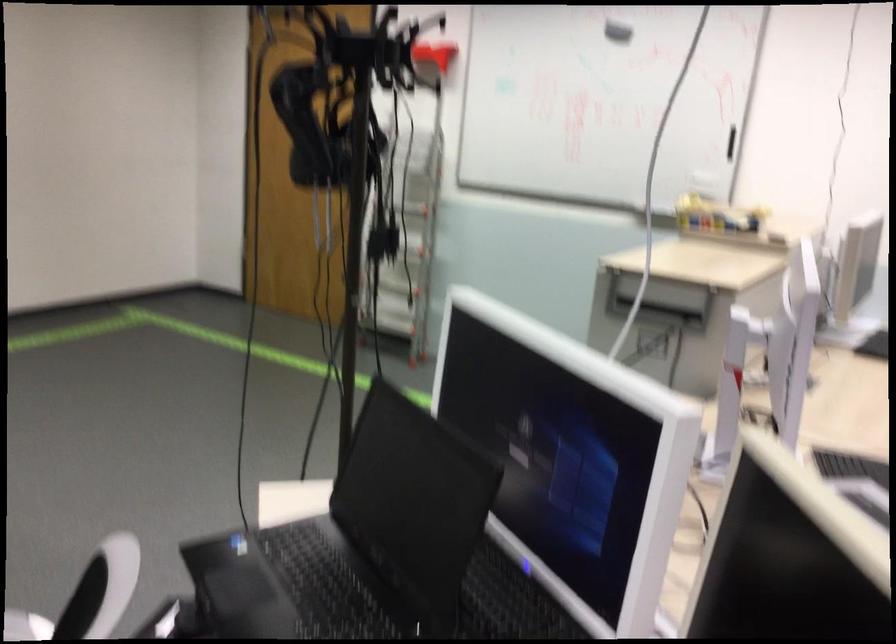
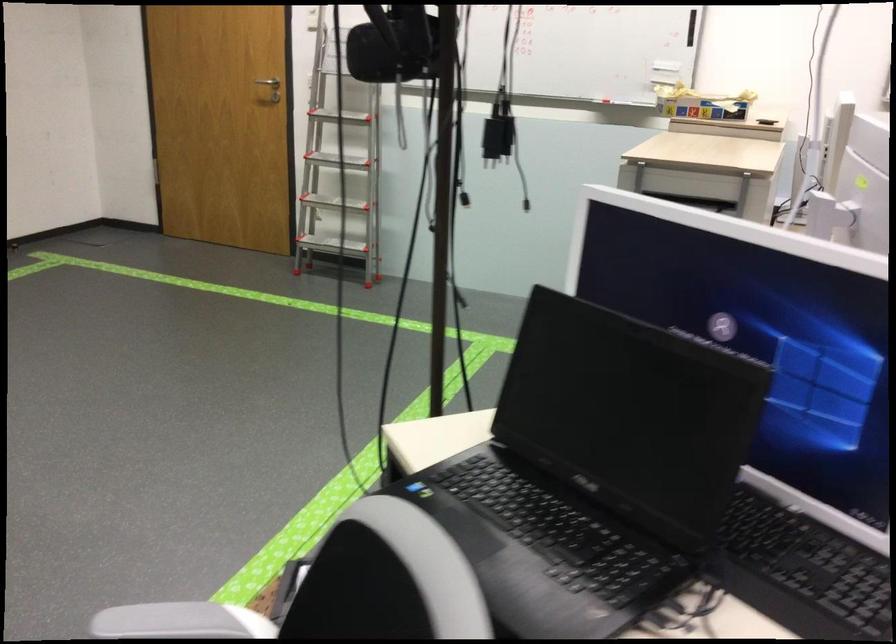
Question: How did the camera likely rotate?

Choices:
 (A) Left
 (B) Right
 (C) Up
 (D) Down

Answer: (B)